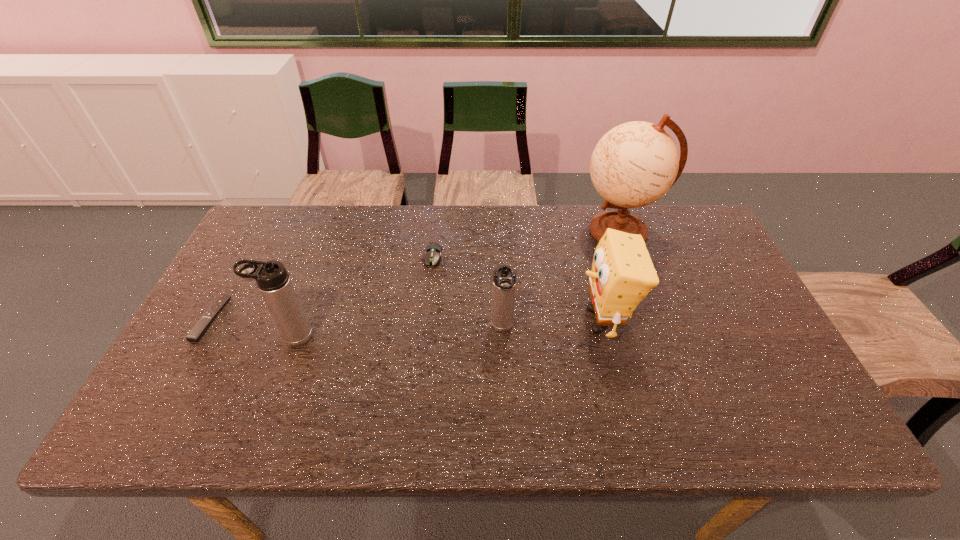
Identify the location of free spot between the fifth tallest object and the taller thermos bottle. This screenshot has height=540, width=960. (362, 297).

Find the location of a particular element. This screenshot has height=540, width=960. free space between the fourth tallest object and the computer mouse is located at coordinates (468, 293).

I want to click on the fifth closest object to the shortest object, so click(634, 164).

Locate which object ranks third in proximity to the fourth object from right to left. Please provide its 2D coordinates. Your answer should be formatted as a tuple, i.e. [(x, y)], where the tuple contains the x and y coordinates of a point satisfying the conditions above.

[(622, 274)]

What are the coordinates of `vacant region that satisfies the following two spatial constraints: 1. on the handle side of the right thermos bottle; 2. on the handle side of the left thermos bottle` in the screenshot? It's located at (503, 336).

At what (x,y) coordinates should I click in order to perform the action: click on blank space that satisfies the following two spatial constraints: 1. on the surface of the globe; 2. on the front side of the shortest object. Please return your answer as a coordinate pair (x, y). The height and width of the screenshot is (540, 960). Looking at the image, I should click on (651, 319).

Find the location of `vacant space that satisfies the following two spatial constraints: 1. on the surface of the globe; 2. on the handle side of the right thermos bottle`. vacant space that satisfies the following two spatial constraints: 1. on the surface of the globe; 2. on the handle side of the right thermos bottle is located at coordinates (655, 328).

Where is `vacant space that satisfies the following two spatial constraints: 1. on the face of the sponge; 2. on the handle side of the shorter thermos bottle`? The image size is (960, 540). vacant space that satisfies the following two spatial constraints: 1. on the face of the sponge; 2. on the handle side of the shorter thermos bottle is located at coordinates (604, 328).